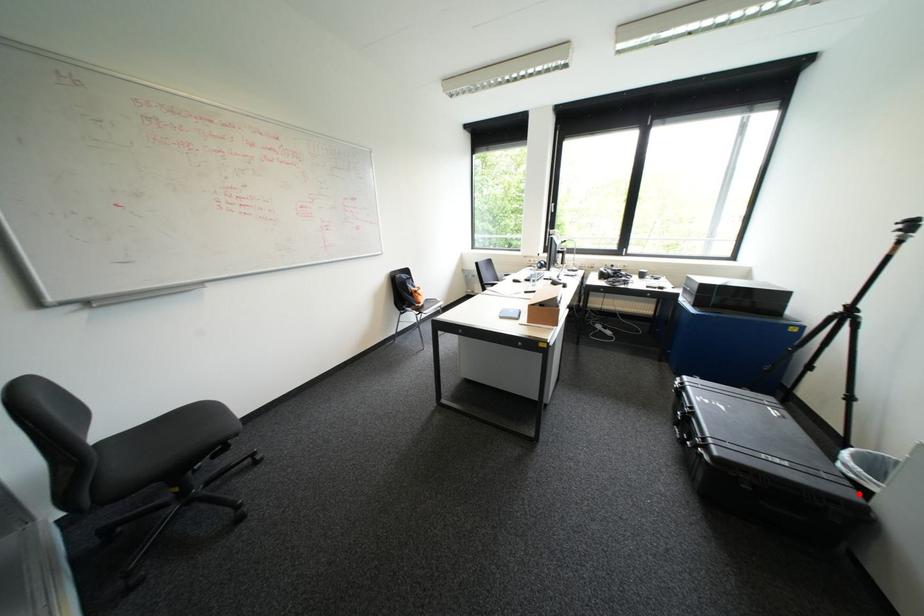
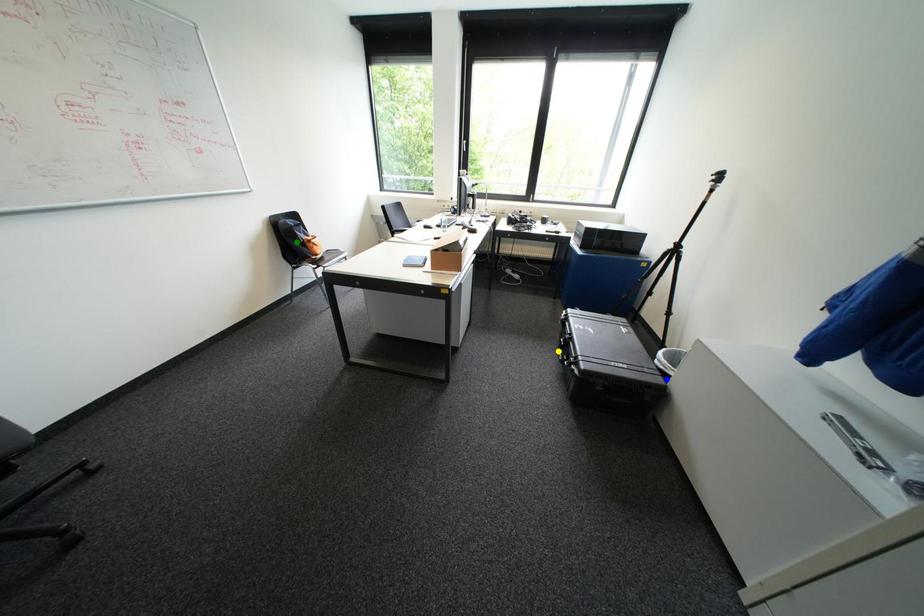
Question: I am providing you with two images of the same scene from different viewpoints. A red point is marked on the first image. You are given multiple points on the second image. Which point in image 2 represents the same 3d spot as the red point in image 1?

Choices:
 (A) green point
 (B) yellow point
 (C) blue point

Answer: (C)